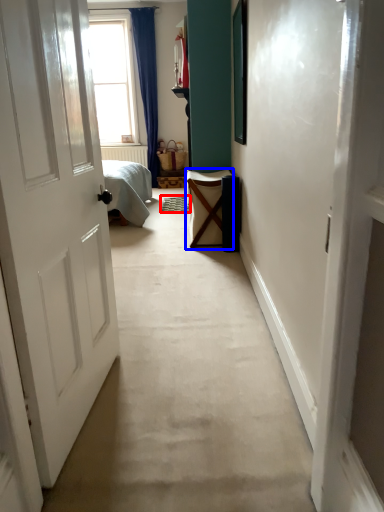
Question: Which point is further to the camera, doormat (highlighted by a red box) or furniture (highlighted by a blue box)?

Choices:
 (A) doormat
 (B) furniture

Answer: (A)